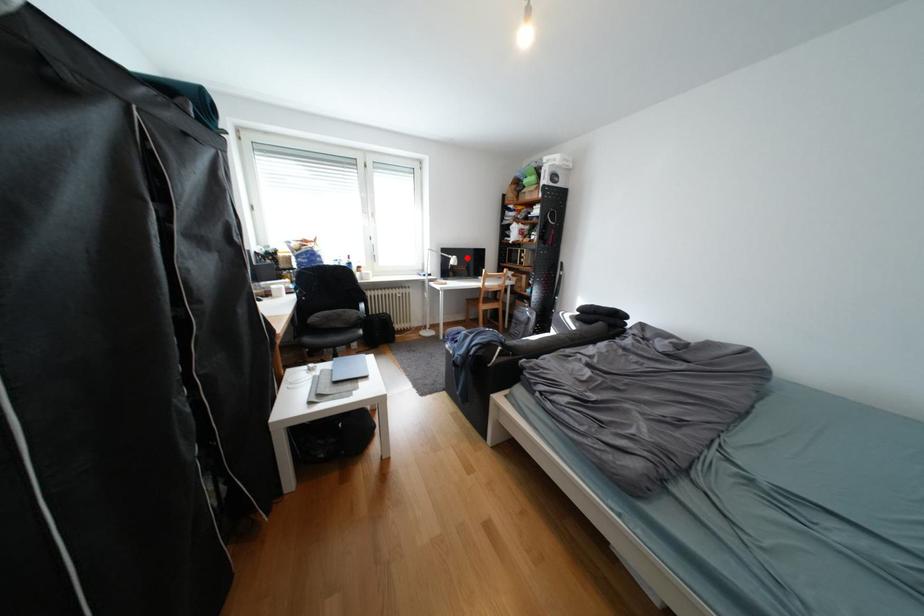
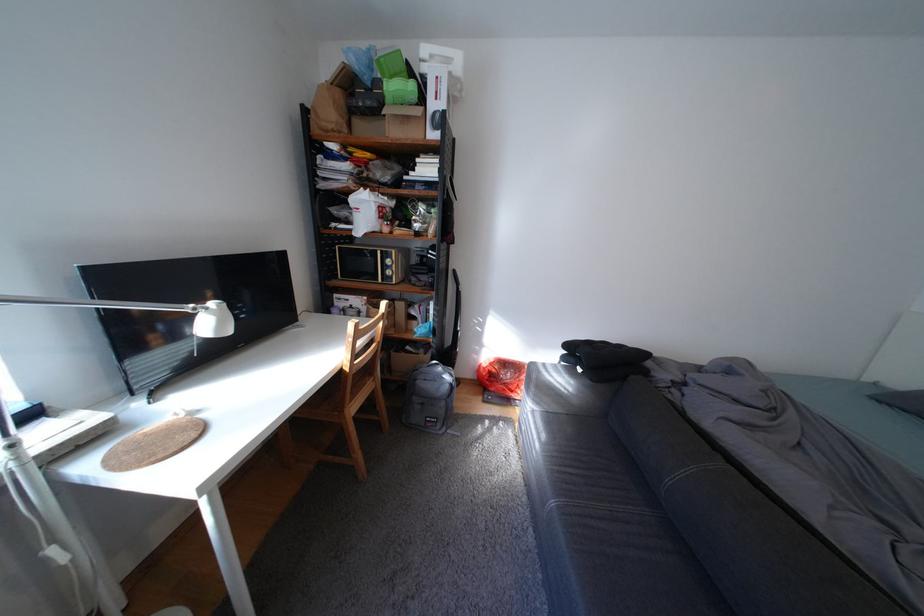
Question: I am providing you with two images of the same scene from different viewpoints. In image1, a red point is highlighted. Considering the same 3D point in image2, which of the following is correct?

Choices:
 (A) It is closer
 (B) It is farther

Answer: (B)